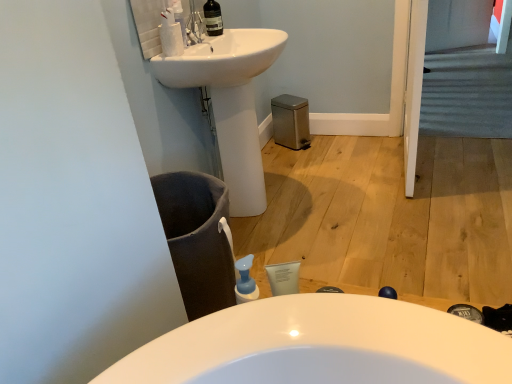
Identify the location of spots to the right of white glossy sink at upper center. This screenshot has width=512, height=384. (350, 198).